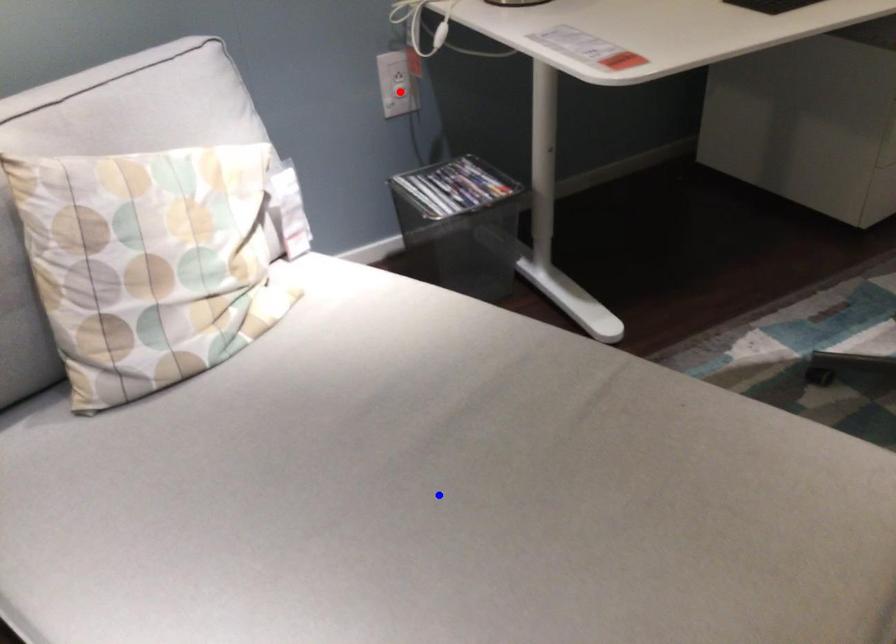
Question: Two points are marked on the image. Which point is closer to the camera?

Choices:
 (A) Blue point is closer.
 (B) Red point is closer.

Answer: (A)